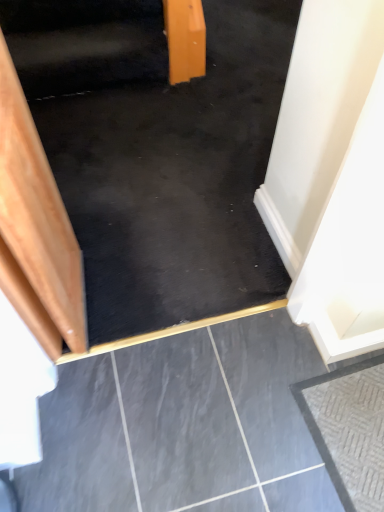
What do you see at coordinates (94, 42) in the screenshot? This screenshot has height=512, width=384. I see `black rubber stairwell at upper center` at bounding box center [94, 42].

The image size is (384, 512). What do you see at coordinates (158, 155) in the screenshot? I see `wooden stairs at left` at bounding box center [158, 155].

Measure the distance between wooden stairs at left and camera.

1.25 meters.

What are the coordinates of `textured gray concrete at lower right, the second concrete positioned from the left` in the screenshot? It's located at (349, 429).

The height and width of the screenshot is (512, 384). In order to click on black rubber stairwell at upper center in this screenshot , I will do `click(94, 42)`.

How many degrees apart are the facing directions of wooden stairs at left and textured gray concrete at lower right, the second concrete positioned from the left?

wooden stairs at left and textured gray concrete at lower right, the second concrete positioned from the left, are facing 89.1 degrees away from each other.

Consider the image. From a real-world perspective, is wooden stairs at left physically located above or below textured gray concrete at lower right, which appears as the first concrete when viewed from the right?

From a real-world perspective, wooden stairs at left is physically above textured gray concrete at lower right, which appears as the first concrete when viewed from the right.

The width and height of the screenshot is (384, 512). What are the coordinates of `concrete on the right of wooden stairs at left` in the screenshot? It's located at (349, 429).

Looking at this image, between wooden stairs at left and textured gray concrete at lower right, which appears as the first concrete when viewed from the right, which one has smaller width?

With smaller width is textured gray concrete at lower right, which appears as the first concrete when viewed from the right.

From the image's perspective, is black polished concrete at center, the second concrete positioned from the right, located above or below black rubber stairwell at upper center?

From the image's perspective, black polished concrete at center, the second concrete positioned from the right, appears below black rubber stairwell at upper center.

Does point (68, 369) lie behind point (127, 8)?

No.

Is black polished concrete at center, the second concrete positioned from the right, at the left side of black rubber stairwell at upper center?

Incorrect, black polished concrete at center, the second concrete positioned from the right, is not on the left side of black rubber stairwell at upper center.

Which of these two, black polished concrete at center, placed as the 1th concrete when sorted from left to right, or black rubber stairwell at upper center, stands taller?

black rubber stairwell at upper center is taller.

Considering the sizes of objects black polished concrete at center, placed as the 1th concrete when sorted from left to right, and wooden stairs at left in the image provided, who is bigger, black polished concrete at center, placed as the 1th concrete when sorted from left to right, or wooden stairs at left?

Answer: wooden stairs at left is bigger.

Based on the photo, measure the distance from black polished concrete at center, placed as the 1th concrete when sorted from left to right, to wooden stairs at left.

black polished concrete at center, placed as the 1th concrete when sorted from left to right, is 25.85 inches from wooden stairs at left.

From the image's perspective, is black polished concrete at center, the second concrete positioned from the right, below wooden stairs at left?

Indeed, from the image's perspective, black polished concrete at center, the second concrete positioned from the right, is shown beneath wooden stairs at left.

Can you confirm if black polished concrete at center, placed as the 1th concrete when sorted from left to right, is shorter than wooden stairs at left?

Yes, black polished concrete at center, placed as the 1th concrete when sorted from left to right, is shorter than wooden stairs at left.

Is wooden stairs at left shorter than black polished concrete at center, the second concrete positioned from the right?

No.

Which object is positioned more to the left, wooden stairs at left or black polished concrete at center, the second concrete positioned from the right?

black polished concrete at center, the second concrete positioned from the right, is more to the left.

Is wooden stairs at left in front of or behind black polished concrete at center, placed as the 1th concrete when sorted from left to right, in the image?

wooden stairs at left is behind black polished concrete at center, placed as the 1th concrete when sorted from left to right.

Is wooden stairs at left smaller than black polished concrete at center, placed as the 1th concrete when sorted from left to right?

Incorrect, wooden stairs at left is not smaller in size than black polished concrete at center, placed as the 1th concrete when sorted from left to right.

Is textured gray concrete at lower right, which appears as the first concrete when viewed from the right, next to wooden stairs at left?

No, textured gray concrete at lower right, which appears as the first concrete when viewed from the right, is not touching wooden stairs at left.

Is wooden stairs at left at the back of textured gray concrete at lower right, the second concrete positioned from the left?

That's not correct — textured gray concrete at lower right, the second concrete positioned from the left, is not looking away from wooden stairs at left.

Is textured gray concrete at lower right, the second concrete positioned from the left, bigger than wooden stairs at left?

No.

Which of these two, textured gray concrete at lower right, the second concrete positioned from the left, or wooden stairs at left, is thinner?

With smaller width is textured gray concrete at lower right, the second concrete positioned from the left.

Considering the positions of points (205, 140) and (142, 23), is point (205, 140) farther from camera compared to point (142, 23)?

No, it is not.

Is wooden stairs at left not inside black rubber stairwell at upper center?

Yes, wooden stairs at left is not within black rubber stairwell at upper center.

Which object is positioned more to the right, wooden stairs at left or black rubber stairwell at upper center?

wooden stairs at left.

From a real-world perspective, is black polished concrete at center, the second concrete positioned from the right, physically located above or below textured gray concrete at lower right, the second concrete positioned from the left?

In terms of real-world spatial position, black polished concrete at center, the second concrete positioned from the right, is below textured gray concrete at lower right, the second concrete positioned from the left.

From the image's perspective, is black polished concrete at center, the second concrete positioned from the right, under textured gray concrete at lower right, the second concrete positioned from the left?

Yes.

Is textured gray concrete at lower right, the second concrete positioned from the left, inside black polished concrete at center, the second concrete positioned from the right?

Indeed, textured gray concrete at lower right, the second concrete positioned from the left, is located within black polished concrete at center, the second concrete positioned from the right.

Who is more distant, black polished concrete at center, placed as the 1th concrete when sorted from left to right, or textured gray concrete at lower right, which appears as the first concrete when viewed from the right?

textured gray concrete at lower right, which appears as the first concrete when viewed from the right.

Starting from the wooden stairs at left, which concrete is the 1st one in front? Please provide its 2D coordinates.

[(349, 429)]

Image resolution: width=384 pixels, height=512 pixels. I want to click on stairwell on the left of black polished concrete at center, the second concrete positioned from the right, so click(94, 42).

Looking at the image, which one is located further to black rubber stairwell at upper center, wooden stairs at left or textured gray concrete at lower right, the second concrete positioned from the left?

textured gray concrete at lower right, the second concrete positioned from the left, lies further to black rubber stairwell at upper center than the other object.

From the image, which object appears to be nearer to wooden stairs at left, black polished concrete at center, placed as the 1th concrete when sorted from left to right, or black rubber stairwell at upper center?

Based on the image, black rubber stairwell at upper center appears to be nearer to wooden stairs at left.

Estimate the real-world distances between objects in this image. Which object is closer to black rubber stairwell at upper center, black polished concrete at center, placed as the 1th concrete when sorted from left to right, or wooden stairs at left?

wooden stairs at left lies closer to black rubber stairwell at upper center than the other object.

Considering their positions, is black polished concrete at center, placed as the 1th concrete when sorted from left to right, positioned closer to textured gray concrete at lower right, which appears as the first concrete when viewed from the right, than black rubber stairwell at upper center?

The object closer to textured gray concrete at lower right, which appears as the first concrete when viewed from the right, is black polished concrete at center, placed as the 1th concrete when sorted from left to right.

When comparing their distances from wooden stairs at left, does black rubber stairwell at upper center or textured gray concrete at lower right, the second concrete positioned from the left, seem further?

Among the two, textured gray concrete at lower right, the second concrete positioned from the left, is located further to wooden stairs at left.

Which object lies further to the anchor point black polished concrete at center, the second concrete positioned from the right, wooden stairs at left or black rubber stairwell at upper center?

Among the two, black rubber stairwell at upper center is located further to black polished concrete at center, the second concrete positioned from the right.

Based on their spatial positions, is wooden stairs at left or black rubber stairwell at upper center closer to textured gray concrete at lower right, the second concrete positioned from the left?

Among the two, wooden stairs at left is located nearer to textured gray concrete at lower right, the second concrete positioned from the left.

When comparing their distances from wooden stairs at left, does textured gray concrete at lower right, the second concrete positioned from the left, or black polished concrete at center, the second concrete positioned from the right, seem closer?

Based on the image, black polished concrete at center, the second concrete positioned from the right, appears to be nearer to wooden stairs at left.

Image resolution: width=384 pixels, height=512 pixels. In order to click on stairs between black rubber stairwell at upper center and textured gray concrete at lower right, which appears as the first concrete when viewed from the right, vertically in this screenshot , I will do `click(158, 155)`.

Identify the location of stairs between black rubber stairwell at upper center and black polished concrete at center, placed as the 1th concrete when sorted from left to right, from top to bottom. (158, 155).

Locate an element on the screen. The width and height of the screenshot is (384, 512). concrete that lies between black rubber stairwell at upper center and black polished concrete at center, placed as the 1th concrete when sorted from left to right, from top to bottom is located at coordinates (349, 429).

At what (x,y) coordinates should I click in order to perform the action: click on concrete between wooden stairs at left and black polished concrete at center, the second concrete positioned from the right, in the up-down direction. Please return your answer as a coordinate pair (x, y). Looking at the image, I should click on (349, 429).